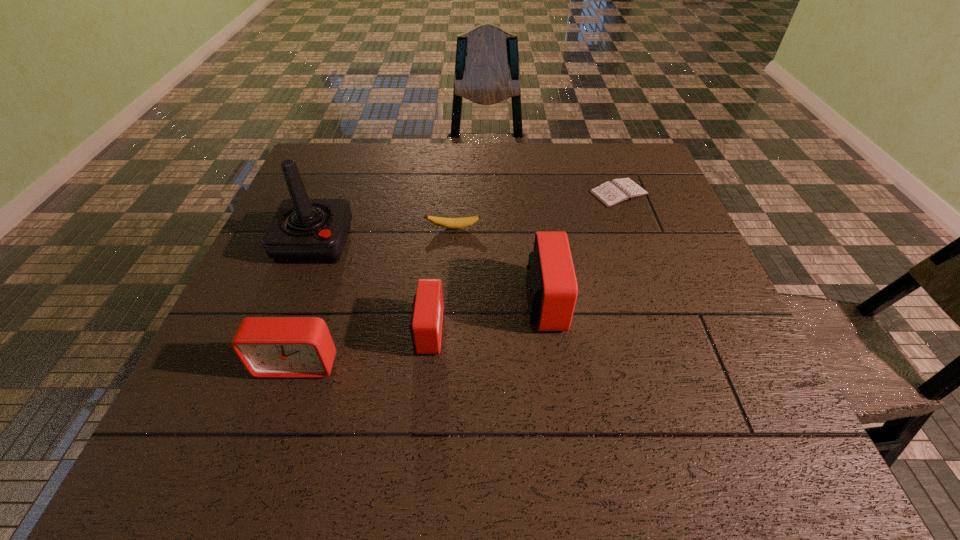
Identify the location of alarm clock identified as the second closest to the third shortest object. This screenshot has width=960, height=540. pos(551,284).